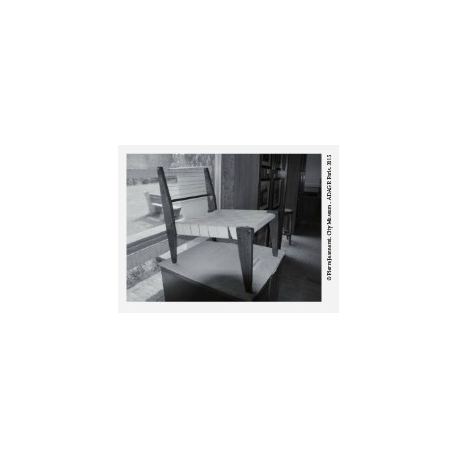
At what (x,y) coordinates should I click in order to perform the action: click on chair. Please return your answer as a coordinate pair (x, y). Looking at the image, I should click on (246, 205), (229, 222).